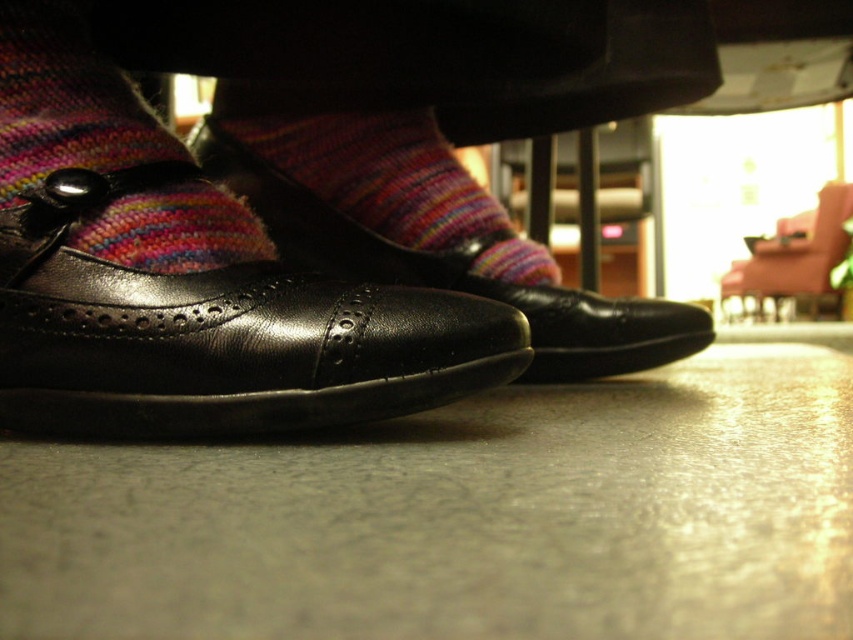
Question: Which point is farther to the camera?

Choices:
 (A) (392, 124)
 (B) (169, 132)
 (C) (238, 150)
 (D) (753, 275)

Answer: (D)

Question: Does multicolored knitted sock at lower left have a greater width compared to leather armchair at lower right?

Choices:
 (A) yes
 (B) no

Answer: (B)

Question: Estimate the real-world distances between objects in this image. Which object is closer to the black leather shoe at center?

Choices:
 (A) multicolored knitted sock at center
 (B) multicolored knitted sock at lower left
 (C) leather armchair at lower right

Answer: (A)

Question: Which object is closer to the camera taking this photo?

Choices:
 (A) multicolored knitted sock at center
 (B) leather armchair at lower right
 (C) black leather shoe at center

Answer: (C)

Question: Does multicolored knitted sock at center appear under leather armchair at lower right?

Choices:
 (A) no
 (B) yes

Answer: (B)

Question: Is multicolored knitted sock at center positioned behind leather armchair at lower right?

Choices:
 (A) no
 (B) yes

Answer: (A)